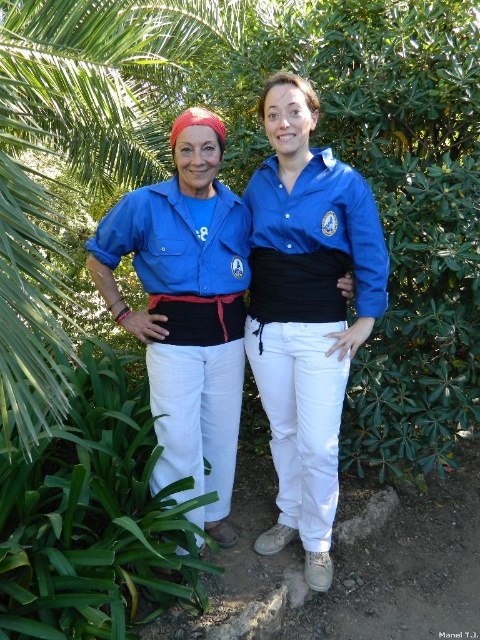
Is blue cotton shirt at center shorter than matte blue shirt at left?

Incorrect, blue cotton shirt at center's height does not fall short of matte blue shirt at left's.

Does blue cotton shirt at center come behind matte blue shirt at left?

No, blue cotton shirt at center is in front of matte blue shirt at left.

You are a GUI agent. You are given a task and a screenshot of the screen. Output one action in this format:
    pyautogui.click(x=<x>, y=<y>)
    Task: Click on the blue cotton shirt at center
    
    Given the screenshot: What is the action you would take?
    pyautogui.click(x=308, y=323)

Can you confirm if green leafy plant at lower left is shorter than matte blue shirt at left?

Correct, green leafy plant at lower left is not as tall as matte blue shirt at left.

Is green leafy plant at lower left in front of matte blue shirt at left?

Yes, it is in front of matte blue shirt at left.

Does point (74, 388) come in front of point (195, 353)?

No, it is behind (195, 353).

Where is `green leafy plant at lower left`? Image resolution: width=480 pixels, height=640 pixels. green leafy plant at lower left is located at coordinates (92, 516).

Can you confirm if green leafy plant at lower left is positioned above blue cotton shirt at center?

No.

What do you see at coordinates (92, 516) in the screenshot? Image resolution: width=480 pixels, height=640 pixels. I see `green leafy plant at lower left` at bounding box center [92, 516].

This screenshot has width=480, height=640. In order to click on green leafy plant at lower left in this screenshot , I will do `click(92, 516)`.